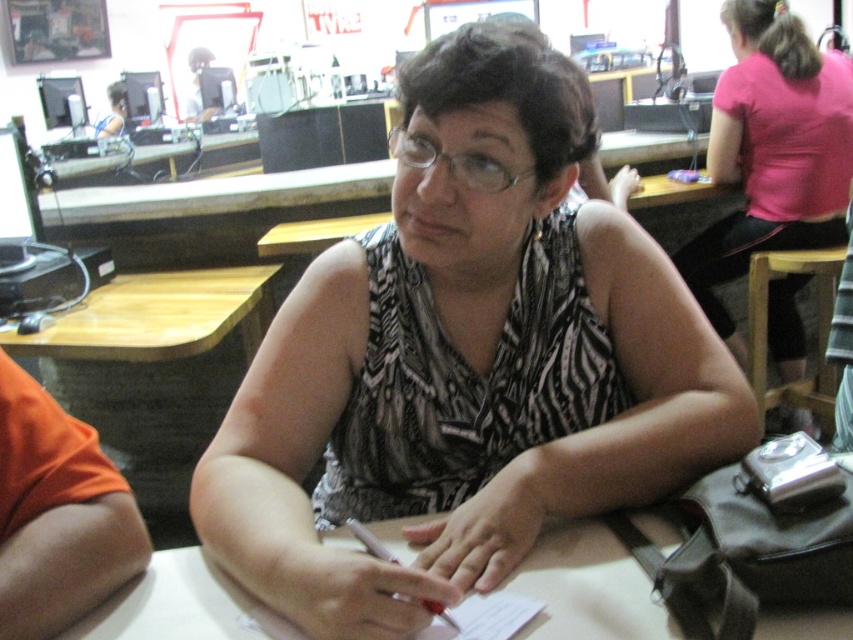
Can you confirm if white matte table at center is shorter than matte black laptop at upper left?

Correct, white matte table at center is not as tall as matte black laptop at upper left.

Does white matte table at center have a lesser width compared to matte black laptop at upper left?

Incorrect, white matte table at center's width is not less than matte black laptop at upper left's.

The height and width of the screenshot is (640, 853). What do you see at coordinates (589, 588) in the screenshot?
I see `white matte table at center` at bounding box center [589, 588].

Where is `white matte table at center`? Image resolution: width=853 pixels, height=640 pixels. white matte table at center is located at coordinates (589, 588).

Is point (802, 58) positioned before point (78, 324)?

No.

Locate an element on the screen. This screenshot has width=853, height=640. pink fabric shirt at upper right is located at coordinates (770, 150).

This screenshot has height=640, width=853. Identify the location of pink fabric shirt at upper right. (770, 150).

You are a GUI agent. You are given a task and a screenshot of the screen. Output one action in this format:
    pyautogui.click(x=<x>, y=<y>)
    Task: Click on the pink fabric shirt at upper right
    
    Given the screenshot: What is the action you would take?
    pyautogui.click(x=770, y=150)

Who is shorter, printed fabric blouse at center or white matte table at center?

Standing shorter between the two is white matte table at center.

Is printed fabric blouse at center taller than white matte table at center?

Yes, printed fabric blouse at center is taller than white matte table at center.

Find the location of a particular element. printed fabric blouse at center is located at coordinates (466, 364).